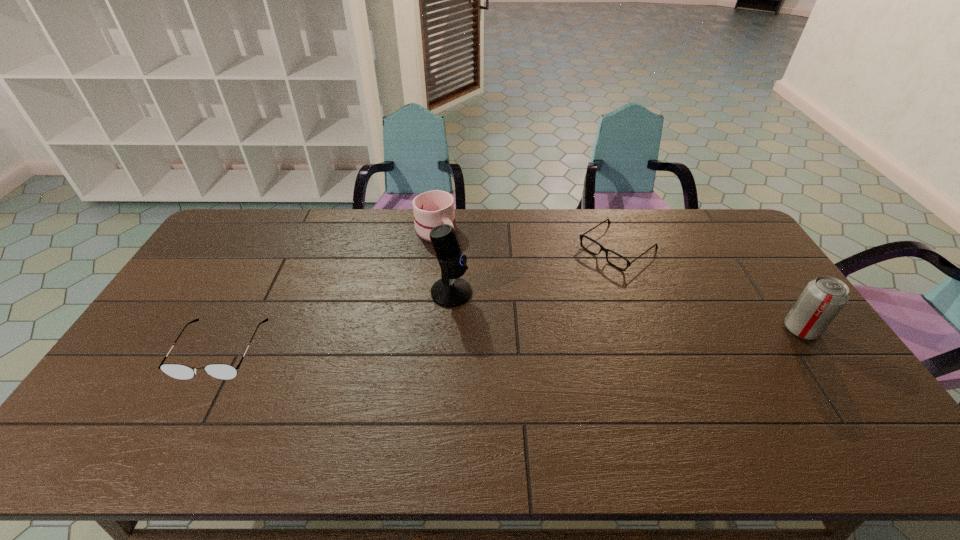
The image size is (960, 540). In order to click on free point that satisfies the following two spatial constraints: 1. on the back side of the shorter spectacles; 2. on the right side of the third farthest object in this screenshot , I will do (454, 248).

You are a GUI agent. You are given a task and a screenshot of the screen. Output one action in this format:
    pyautogui.click(x=<x>, y=<y>)
    Task: Click on the vacant space that satisfies the following two spatial constraints: 1. on the front side of the tallest object; 2. on the right side of the mug
    
    Given the screenshot: What is the action you would take?
    pyautogui.click(x=428, y=293)